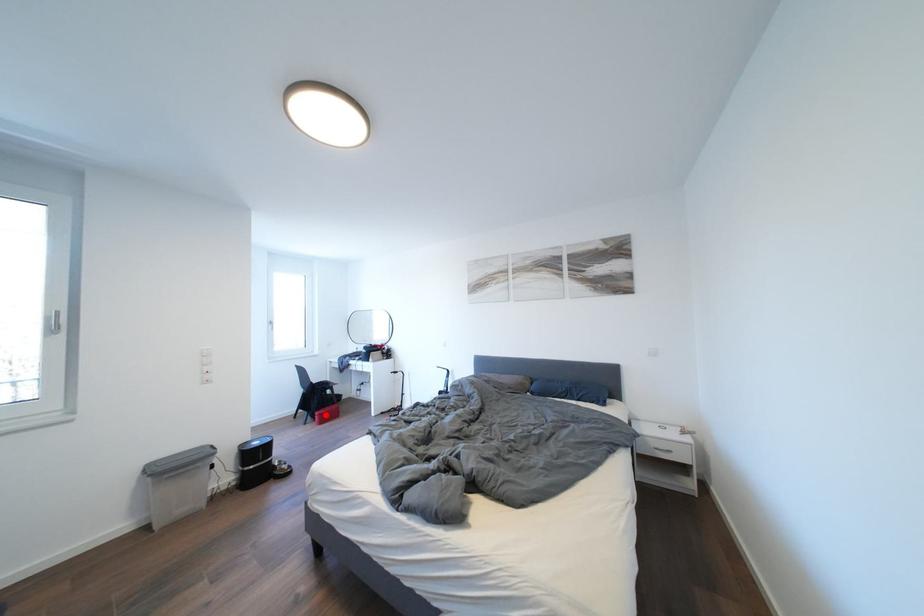
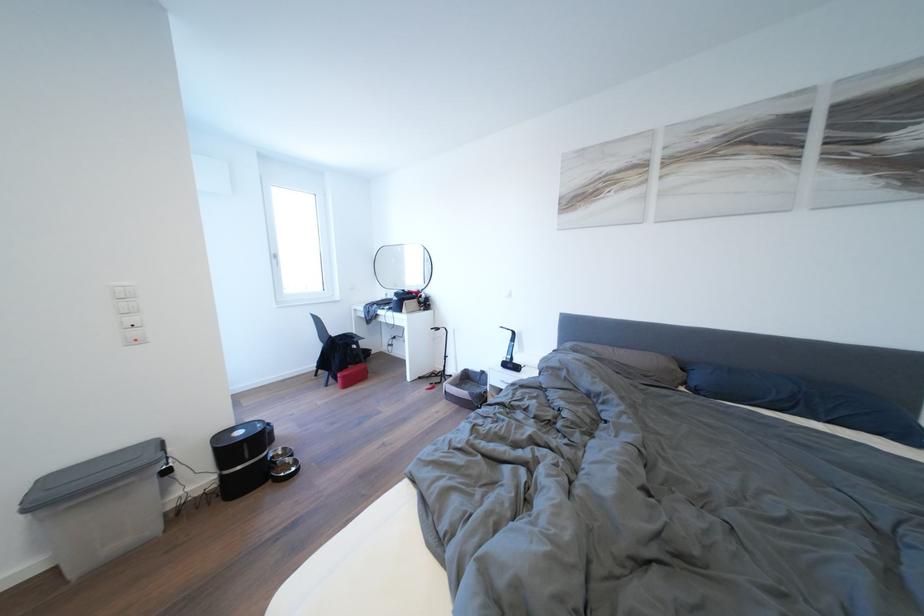
Question: I am providing you with two images of the same scene from different viewpoints. A red point is shown in image1. For the corresponding object point in image2, is it positioned nearer or farther from the camera?

Choices:
 (A) Nearer
 (B) Farther

Answer: (A)